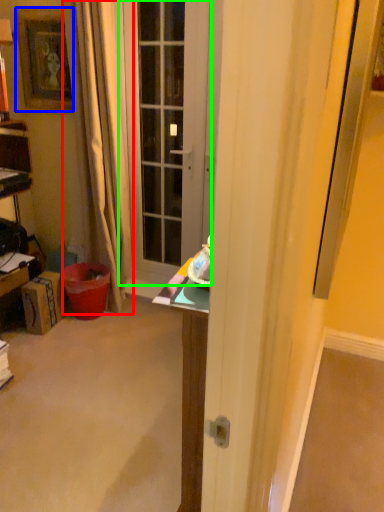
Question: Based on their relative distances, which object is nearer to curtain (highlighted by a red box)? Choose from picture frame (highlighted by a blue box) and door (highlighted by a green box).

Choices:
 (A) picture frame
 (B) door

Answer: (A)